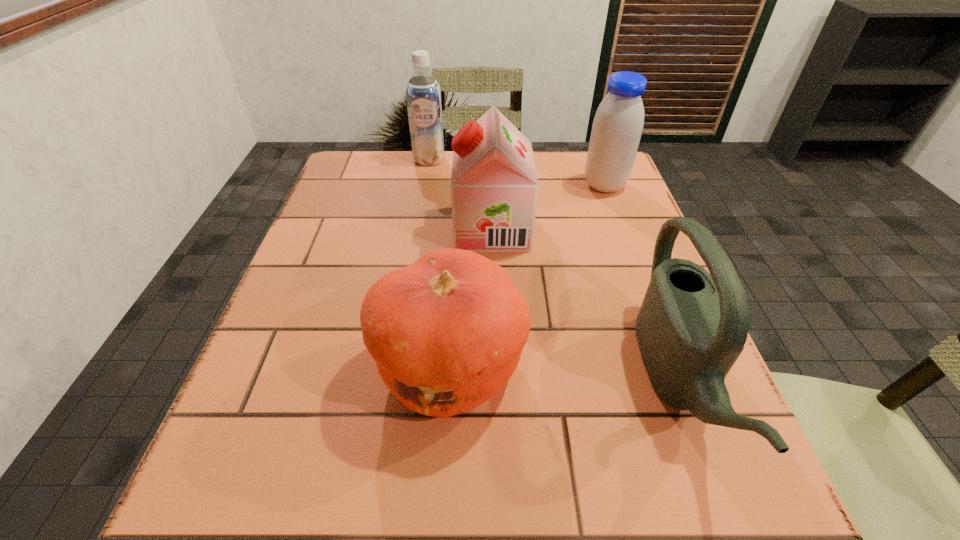
Where is `unoccupied area between the watering can and the pumpkin`? The image size is (960, 540). unoccupied area between the watering can and the pumpkin is located at coordinates (564, 374).

You are a GUI agent. You are given a task and a screenshot of the screen. Output one action in this format:
    pyautogui.click(x=<x>, y=<y>)
    Task: Click on the blank region between the pumpkin and the watering can
    
    Given the screenshot: What is the action you would take?
    pyautogui.click(x=564, y=374)

Where is `free spot between the pumpkin and the fourth nearest object`? free spot between the pumpkin and the fourth nearest object is located at coordinates (527, 276).

Where is `vacant space that's between the pumpkin and the watering can`? vacant space that's between the pumpkin and the watering can is located at coordinates (564, 374).

Locate which object ranks fourth in proximity to the rightmost soya milk. Please provide its 2D coordinates. Your answer should be formatted as a tuple, i.e. [(x, y)], where the tuple contains the x and y coordinates of a point satisfying the conditions above.

[(446, 332)]

Choose which object is the third nearest neighbor to the second soya milk from right to left. Please provide its 2D coordinates. Your answer should be formatted as a tuple, i.e. [(x, y)], where the tuple contains the x and y coordinates of a point satisfying the conditions above.

[(423, 95)]

Where is `soya milk that is the second closest to the third nearest object`? soya milk that is the second closest to the third nearest object is located at coordinates (423, 95).

Where is `soya milk that can be found as the second closest to the watering can`? soya milk that can be found as the second closest to the watering can is located at coordinates (618, 123).

The width and height of the screenshot is (960, 540). I want to click on vacant region that satisfies the following two spatial constraints: 1. on the label of the pumpkin; 2. on the right side of the leftmost soya milk, so click(395, 368).